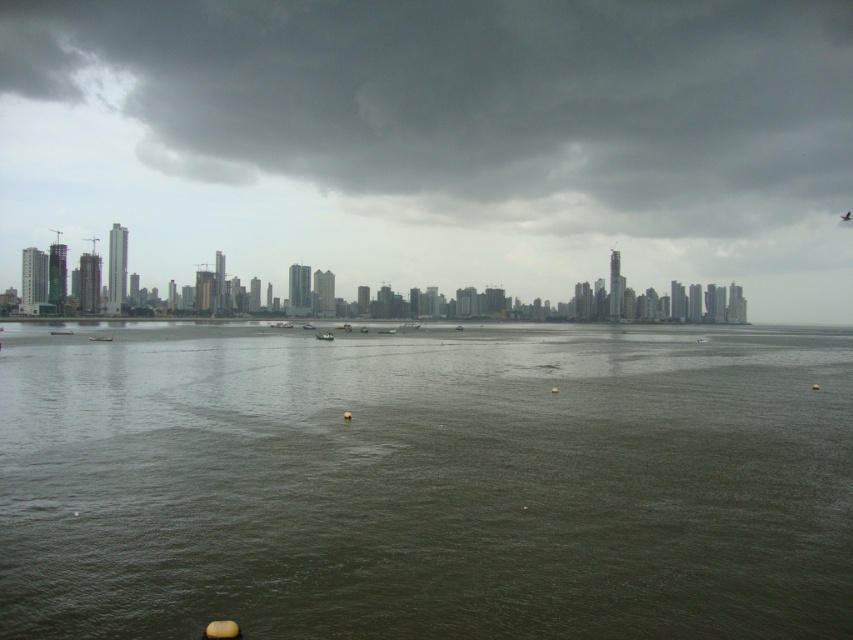
Question: Does dark green water at center come in front of dark gray cloud at upper center?

Choices:
 (A) yes
 (B) no

Answer: (A)

Question: Which of the following is the farthest from the observer?

Choices:
 (A) (631, 52)
 (B) (289, 612)

Answer: (A)

Question: Does dark green water at center appear on the left side of dark gray cloud at upper center?

Choices:
 (A) yes
 (B) no

Answer: (B)

Question: Observing the image, what is the correct spatial positioning of dark green water at center in reference to dark gray cloud at upper center?

Choices:
 (A) left
 (B) right

Answer: (B)

Question: Which of the following is the closest to the observer?

Choices:
 (A) pyautogui.click(x=42, y=417)
 (B) pyautogui.click(x=548, y=150)

Answer: (A)

Question: Which of the following is the farthest from the observer?

Choices:
 (A) dark green water at center
 (B) dark gray cloud at upper center

Answer: (B)